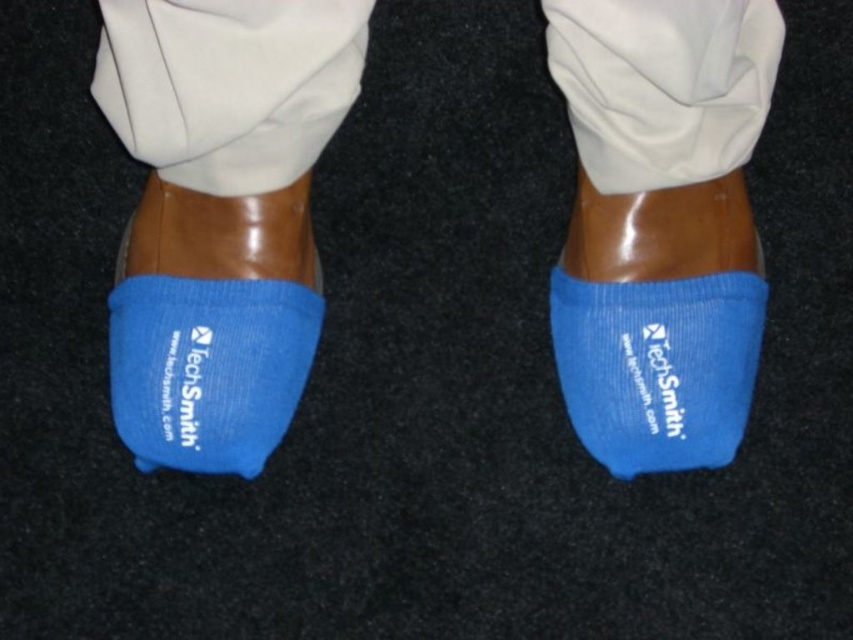
Does point (616, 38) come farther from viewer compared to point (730, 307)?

No, (616, 38) is closer to viewer.

Which is in front, point (181, 147) or point (737, 429)?

Point (181, 147) is more forward.

I want to click on blue fabric socks at center, so click(x=219, y=214).

The width and height of the screenshot is (853, 640). What do you see at coordinates (212, 326) in the screenshot?
I see `blue fabric sock at lower left` at bounding box center [212, 326].

Can you confirm if blue fabric sock at lower left is shorter than blue fabric sock at center?

Incorrect, blue fabric sock at lower left's height does not fall short of blue fabric sock at center's.

Does point (224, 464) come farther from viewer compared to point (740, 369)?

Yes.

Locate an element on the screen. This screenshot has height=640, width=853. blue fabric sock at lower left is located at coordinates (212, 326).

Does blue fabric socks at center have a smaller size compared to blue fabric sock at lower left?

Incorrect, blue fabric socks at center is not smaller in size than blue fabric sock at lower left.

In the scene shown: Is blue fabric socks at center positioned behind blue fabric sock at lower left?

No, it is not.

The height and width of the screenshot is (640, 853). Find the location of `blue fabric socks at center`. blue fabric socks at center is located at coordinates (219, 214).